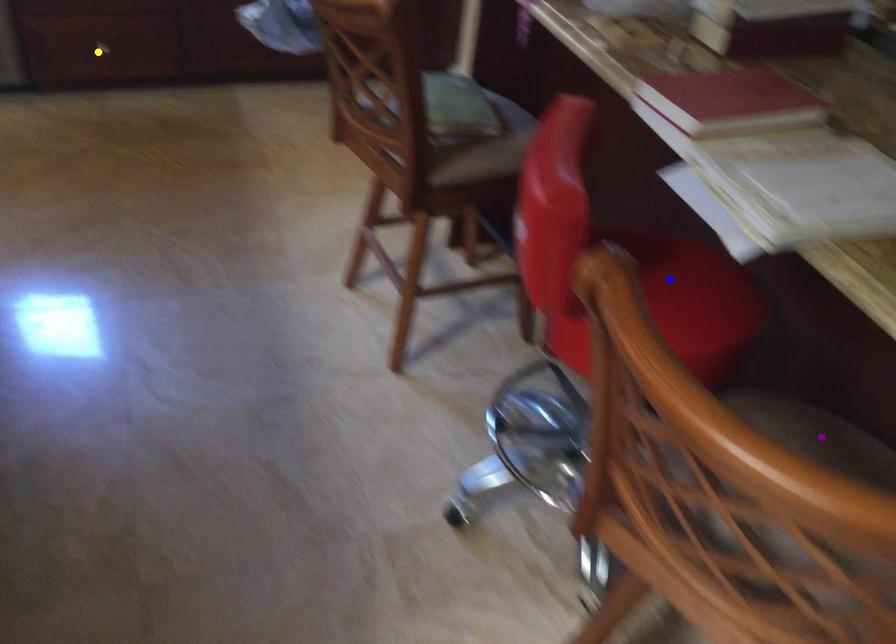
Order these from nearest to farthest:
yellow point
blue point
purple point

purple point → blue point → yellow point